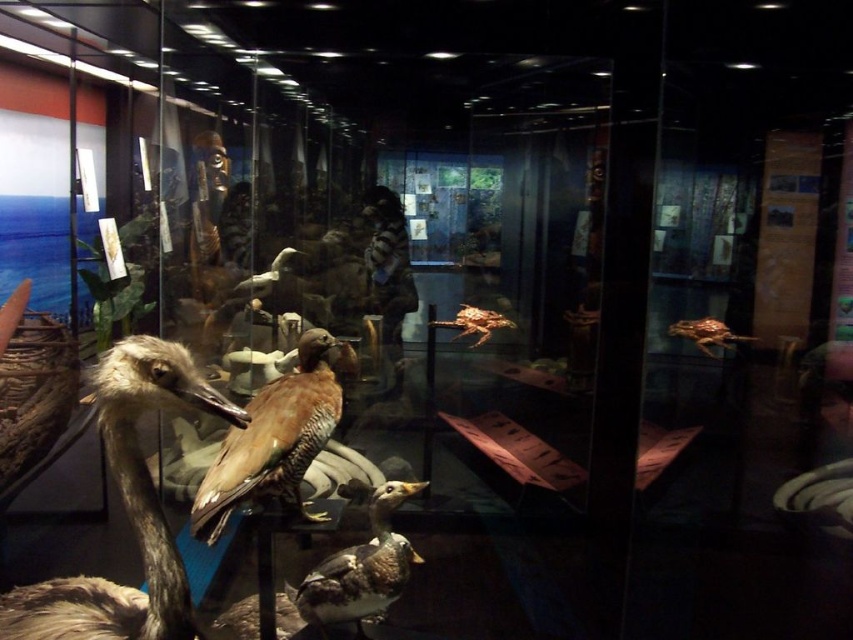
Question: Estimate the real-world distances between objects in this image. Which object is farther from the brown feathered bird at left?

Choices:
 (A) brown feathered bird at right
 (B) brown matte duck at center
 (C) brown feathered duck at center

Answer: (A)

Question: Is brown speckled feathers at center positioned behind brown feathered bird at right?

Choices:
 (A) no
 (B) yes

Answer: (A)

Question: Considering the real-world distances, which object is farthest from the brown feathered bird at right?

Choices:
 (A) brown speckled feathers at center
 (B) brown matte duck at center
 (C) brown feathered bird at left

Answer: (C)

Question: Which point appears farthest from the camera in this image?

Choices:
 (A) (93, 387)
 (B) (711, 332)

Answer: (B)

Question: Is brown feathered duck at center positioned behind brown matte duck at center?

Choices:
 (A) yes
 (B) no

Answer: (B)

Question: Does brown feathered bird at right lie behind brown matte duck at center?

Choices:
 (A) yes
 (B) no

Answer: (B)